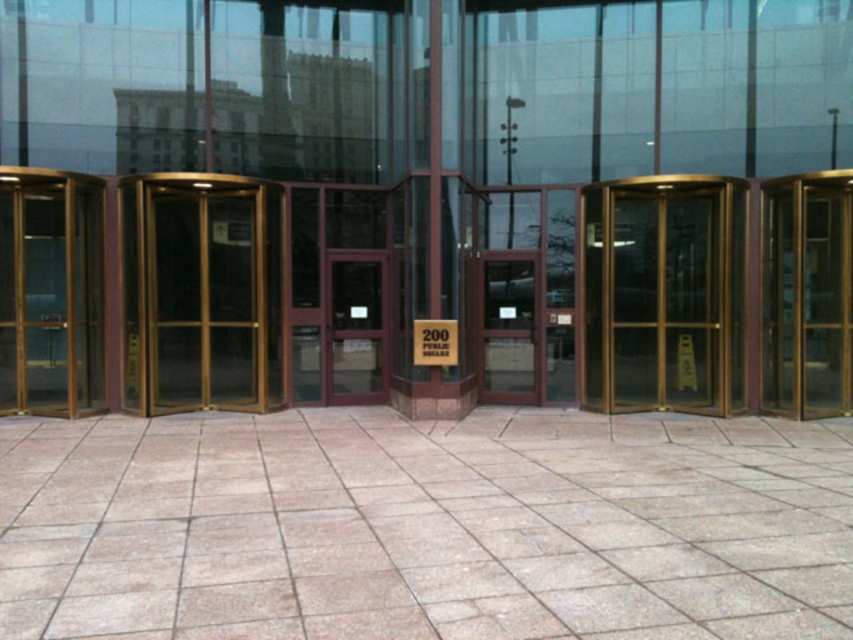
Question: Does gold metallic elevator at left lie in front of matte glass door at center?

Choices:
 (A) yes
 (B) no

Answer: (A)

Question: Which point is closer to the camera?

Choices:
 (A) (416, 348)
 (B) (647, 237)
 (C) (368, 342)
 (D) (817, 269)

Answer: (A)

Question: Which point is closer to the camera?

Choices:
 (A) (453, 352)
 (B) (368, 310)

Answer: (A)

Question: Estimate the real-world distances between objects in this image. Which object is closer to the mahogany wood door at center?

Choices:
 (A) matte glass door at center
 (B) white paper sign at center
 (C) gold reflective glass door at center
 (D) gold metallic elevator at right

Answer: (B)

Question: Can you confirm if gold/glass door at center is bigger than gold reflective glass door at center?

Choices:
 (A) yes
 (B) no

Answer: (A)

Question: Can you confirm if gold/glass door at center is bigger than gold metallic elevator at right?

Choices:
 (A) yes
 (B) no

Answer: (A)